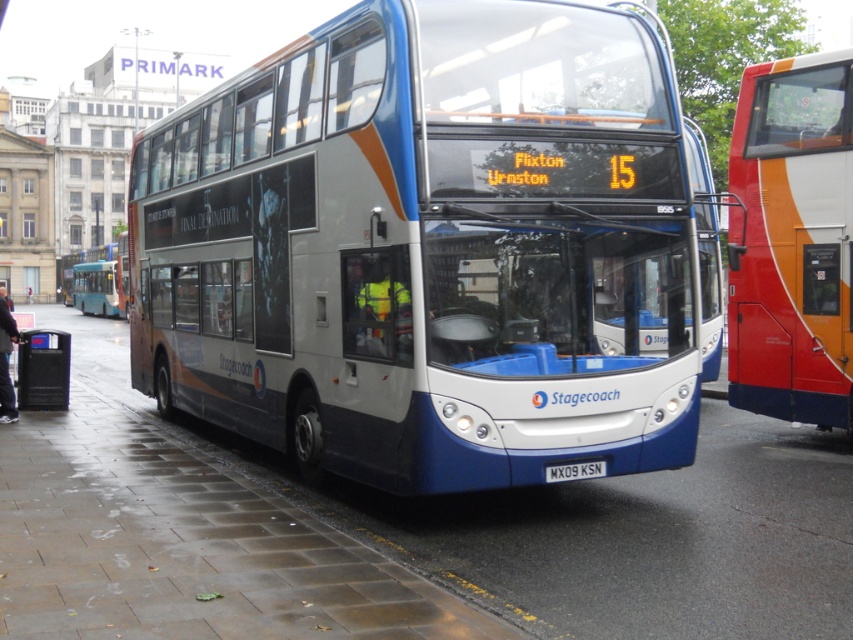
You are a pedestrian standing at the bus station. You see the blue metallic bus at center and the black leather jacket at lower left. Which object is closer to you?

The black leather jacket at lower left is closer to you because it is positioned above the blue metallic bus at center, indicating it is nearer in the visual hierarchy.

You are a pedestrian trying to cross the road at the bus station. You see the wet concrete pavement at lower center and the matte black bus at center. Which object is closer to your right side when facing the bus station?

The wet concrete pavement at lower center is positioned on the right side of matte black bus at center, so it is closer to your right side when facing the bus station.